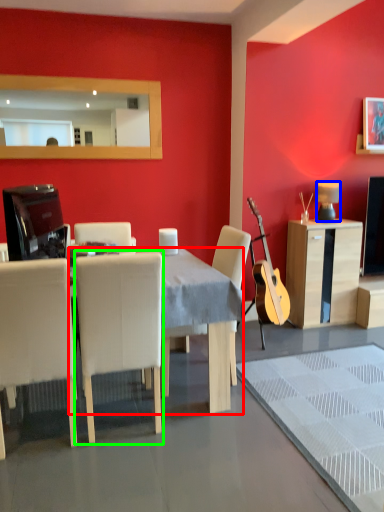
Question: Which is farther away from desk (highlighted by a red box)? lamp (highlighted by a blue box) or chair (highlighted by a green box)?

Choices:
 (A) lamp
 (B) chair

Answer: (A)